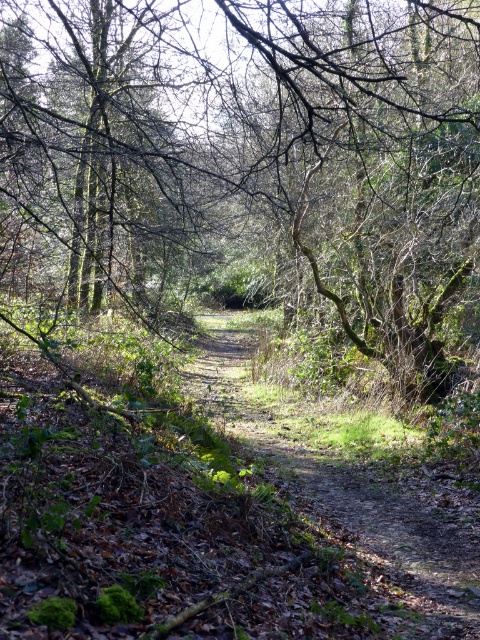
Question: Is the position of green mossy tree at center more distant than that of dirt path at center?

Choices:
 (A) yes
 (B) no

Answer: (B)

Question: Which of the following is the farthest from the observer?

Choices:
 (A) (421, 632)
 (B) (314, 268)

Answer: (B)

Question: Is green mossy tree at center positioned before dirt path at center?

Choices:
 (A) yes
 (B) no

Answer: (A)

Question: Can you confirm if green mossy tree at center is wider than dirt path at center?

Choices:
 (A) yes
 (B) no

Answer: (A)

Question: Which point is farther to the camera?

Choices:
 (A) dirt path at center
 (B) green mossy tree at center

Answer: (A)